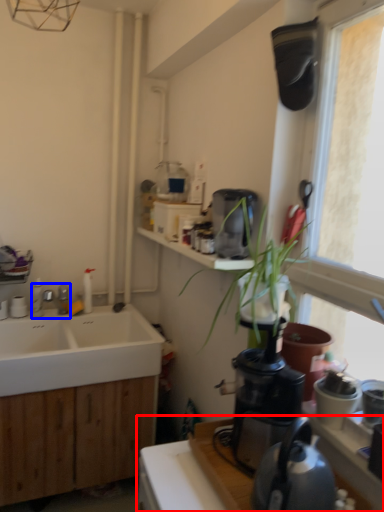
Question: Among these objects, which one is farthest to the camera, countertop (highlighted by a red box) or tap (highlighted by a blue box)?

Choices:
 (A) countertop
 (B) tap

Answer: (B)